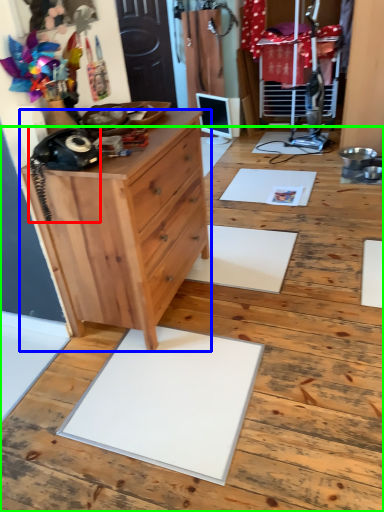
Question: Based on their relative distances, which object is farther from equipment (highlighted by a red box)? Choose from chest of drawers (highlighted by a blue box) and hardwood (highlighted by a green box).

Choices:
 (A) chest of drawers
 (B) hardwood

Answer: (B)